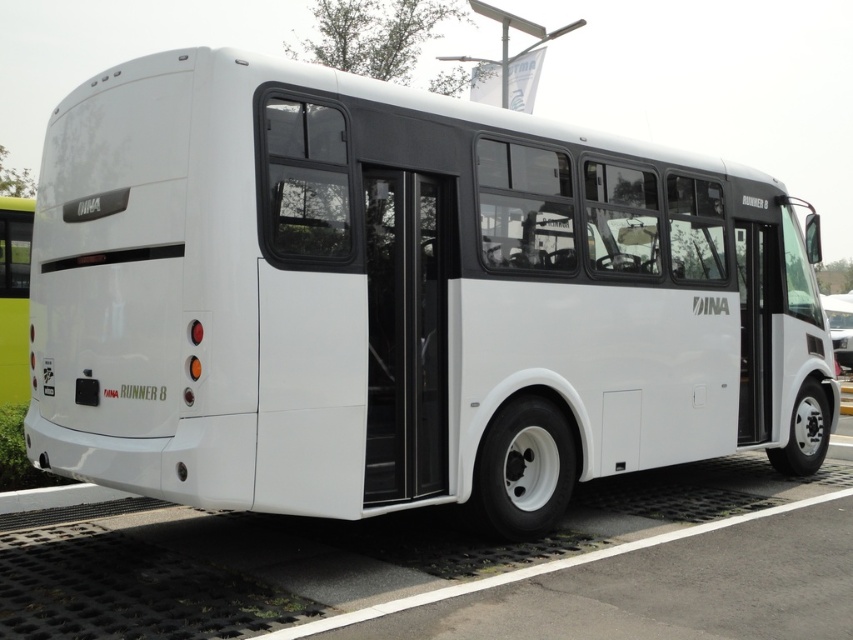
Question: Which point is farther to the camera?

Choices:
 (A) white matte door at center
 (B) transparent glass door at center
 (C) white matte bus at right
 (D) white matte bus at center

Answer: (C)

Question: Can you confirm if white matte bus at center is bigger than white matte door at center?

Choices:
 (A) no
 (B) yes

Answer: (A)

Question: Among these points, which one is farthest from the camera?

Choices:
 (A) (834, 337)
 (B) (187, 145)

Answer: (A)

Question: Is white matte bus at center below white matte bus at left?

Choices:
 (A) no
 (B) yes

Answer: (B)

Question: Does transparent glass door at center have a greater width compared to white matte bus at right?

Choices:
 (A) no
 (B) yes

Answer: (A)

Question: Estimate the real-world distances between objects in this image. Which object is closer to the white matte bus at center?

Choices:
 (A) white matte door at center
 (B) transparent glass door at center

Answer: (B)